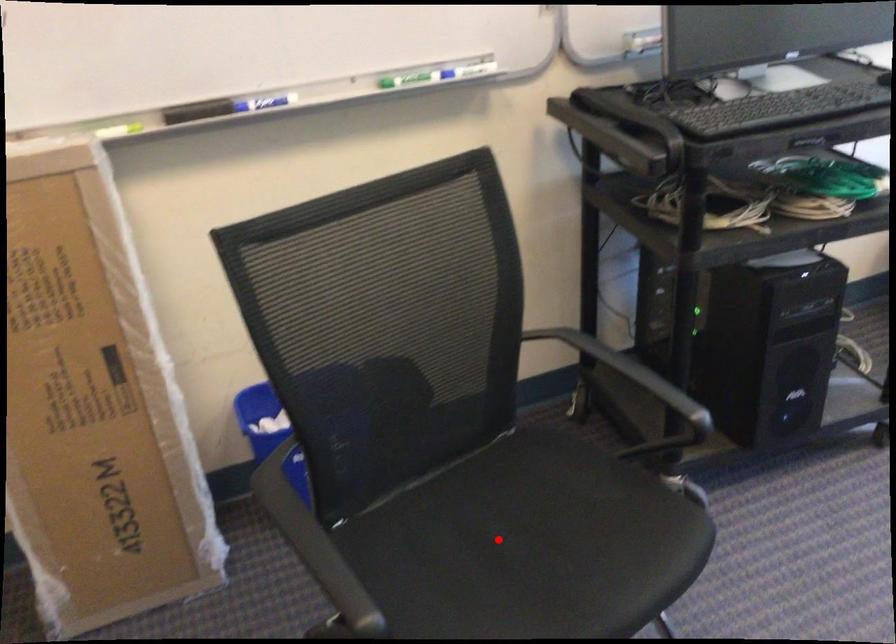
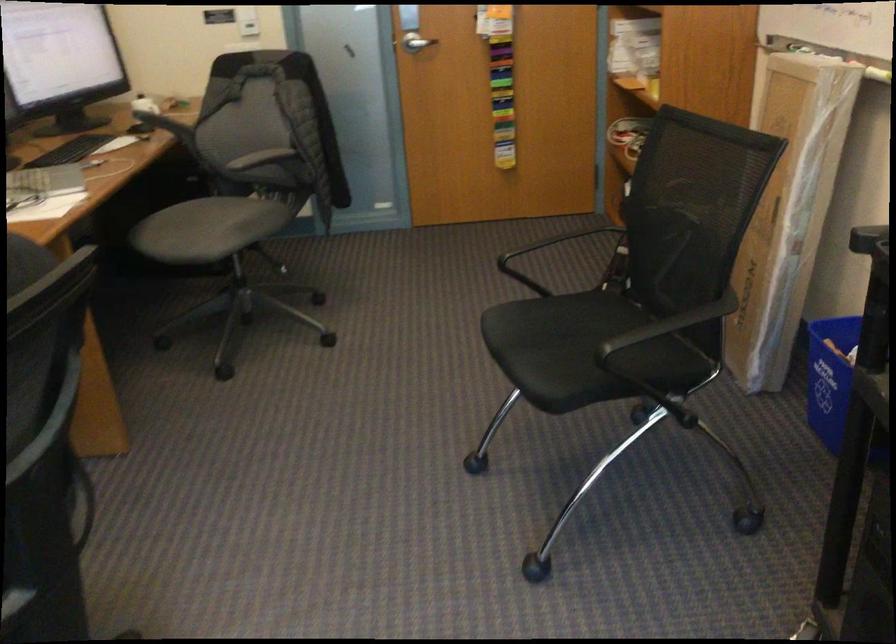
The point at the highlighted location is marked in the first image. Where is the corresponding point in the second image?

(583, 351)